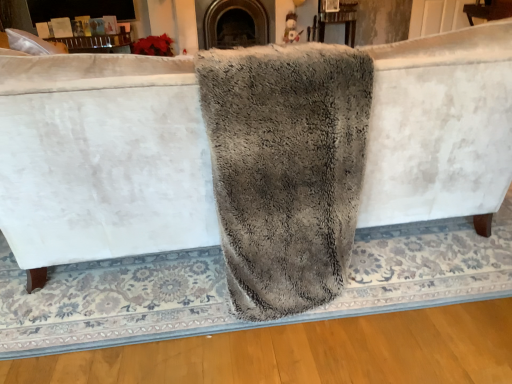
Question: From the image's perspective, is wooden table at upper center located above or below gray fluffy bath towel at center?

Choices:
 (A) above
 (B) below

Answer: (A)

Question: Based on their positions, is wooden table at upper center located to the left or right of gray fluffy bath towel at center?

Choices:
 (A) left
 (B) right

Answer: (B)

Question: Considering the real-world distances, which object is closest to the gray fluffy bath towel at center?

Choices:
 (A) dark gray stone fireplace at center
 (B) wooden table at upper center

Answer: (A)

Question: Which of these objects is positioned closest to the gray fluffy bath towel at center?

Choices:
 (A) wooden table at upper center
 (B) dark gray stone fireplace at center

Answer: (B)